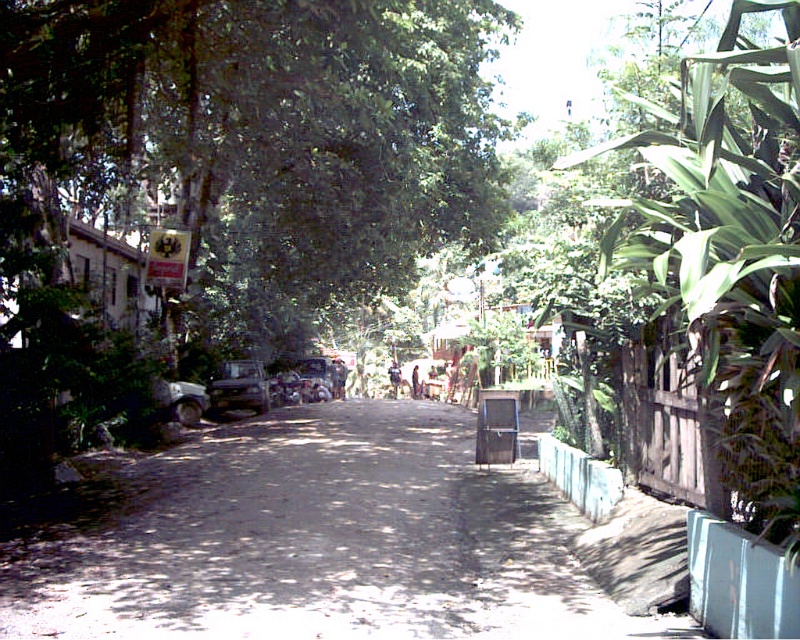
You are driving a car that is 2 meters wide. You need to pass through the area between the green leafy tree at upper center and the dirt road at center. Can your car fit through the space between them?

The green leafy tree at upper center is to the left of the dirt road at center, but the description does not provide the width of the space between them. Therefore, it is impossible to determine if the car can fit through the space.

You are standing on the sunlit street scene and want to move from the camera position to point A at coordinates point [438,51] and point B at coordinates point [220,403]. Which point will you reach first?

You will reach point A at coordinates point [438,51] first because it is closer to the camera than point B at coordinates point [220,403].

You are standing at the point marked as point (322, 541) on the dirt road at center. Looking around, you see the road flanked by tall trees forming a canopy overhead. To your left, there is a building partially hidden by vegetation. Which direction should you walk to reach the building on the left side of the road?

Since the building is on the left side of the road and you are at the center, you should walk towards the left side of the dirt road at center to reach the building.